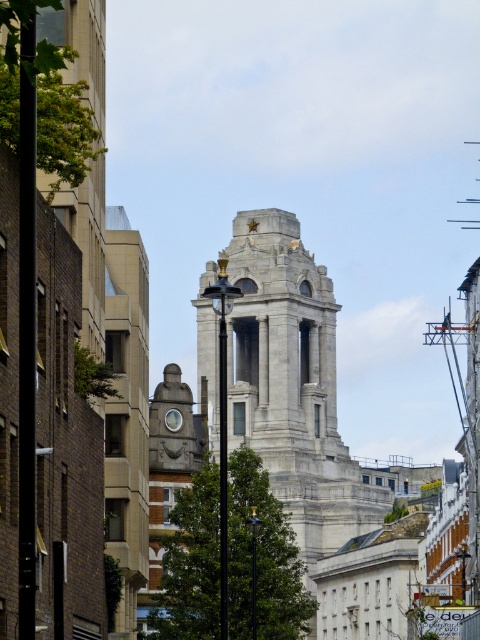
Is point (339, 506) closer to viewer compared to point (169, 410)?

No, it is not.

Locate an element on the screen. gray stone tower at center is located at coordinates (291, 384).